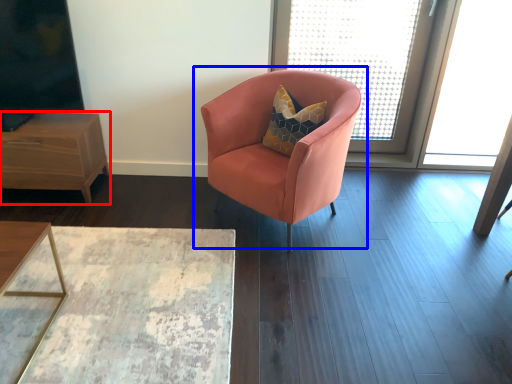
Question: Which object appears farthest to the camera in this image, nightstand (highlighted by a red box) or chair (highlighted by a blue box)?

Choices:
 (A) nightstand
 (B) chair

Answer: (A)